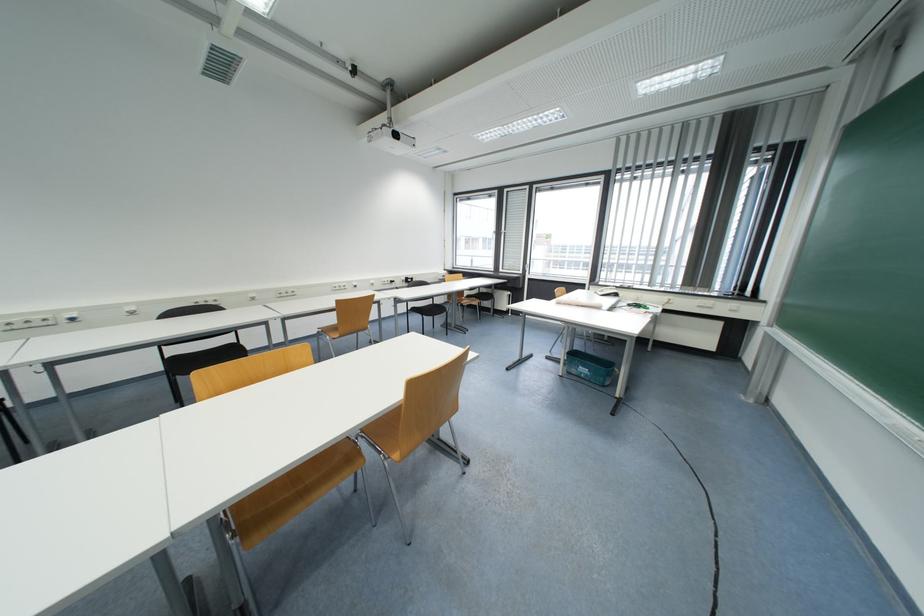
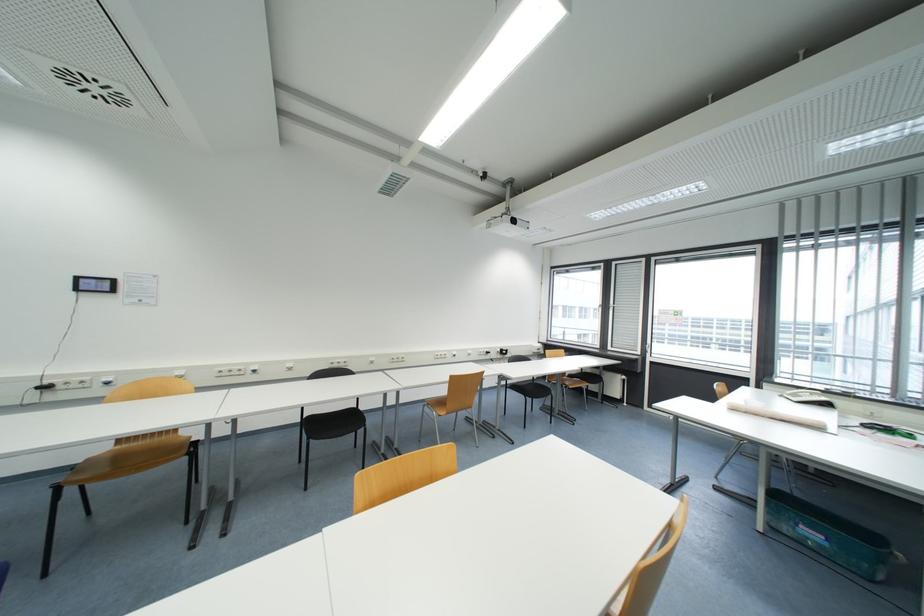
Question: The camera is either moving clockwise (left) or counter-clockwise (right) around the object. The first image is from the beginning of the video and the second image is from the end. Is the camera moving left or right when shooting the video?

Choices:
 (A) Left
 (B) Right

Answer: (B)